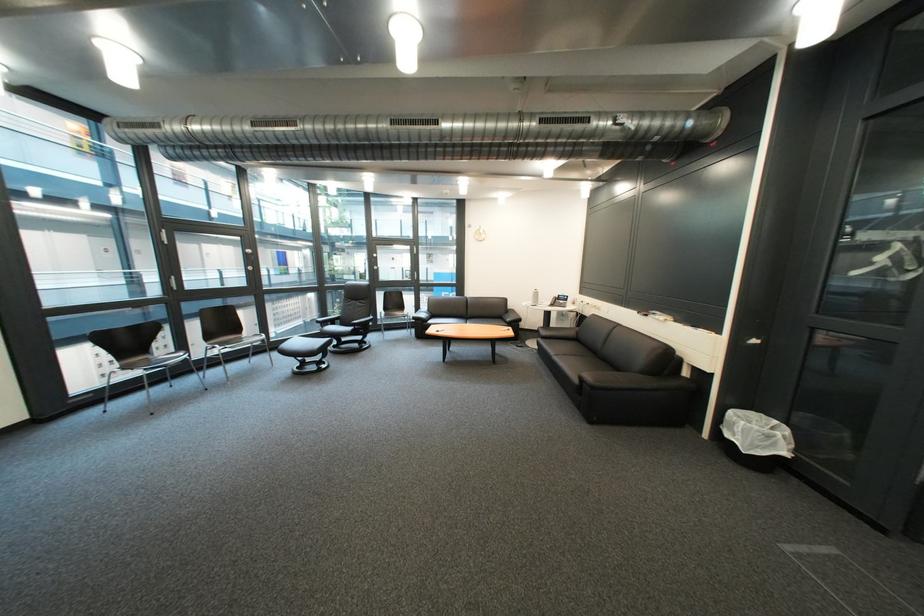
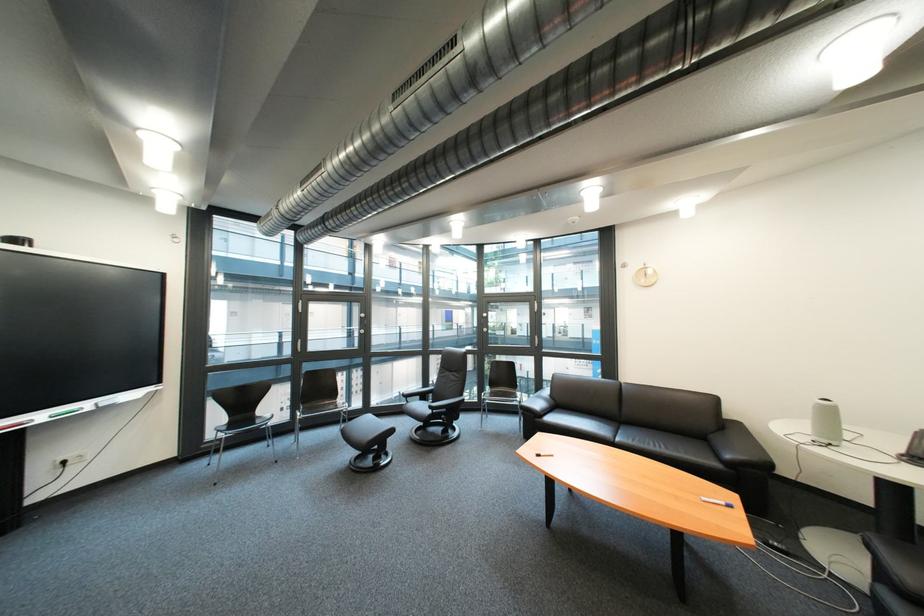
Find the pixel in the second image that matches point 548,293 in the first image.

(833, 406)